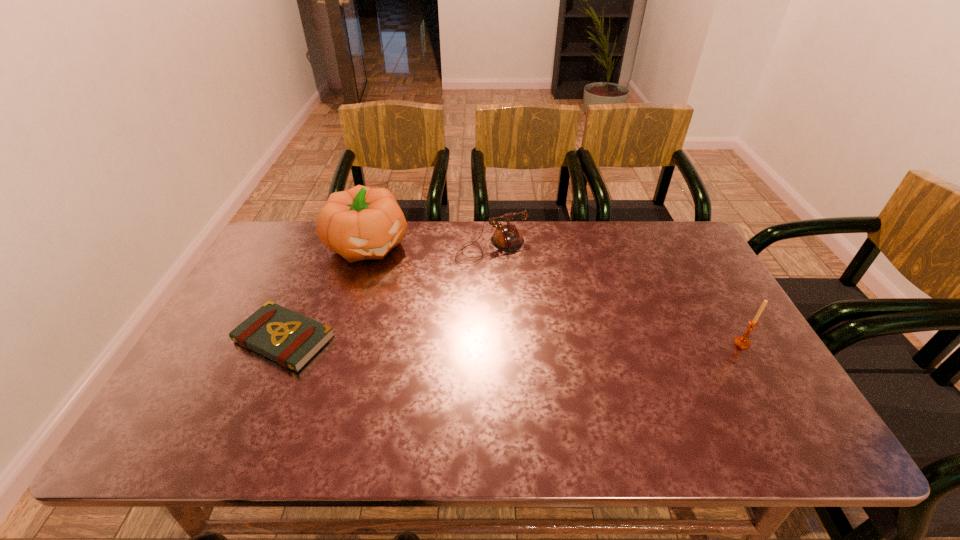
I want to click on free location located 0.320m on the rotary dial of the third tallest object, so click(x=555, y=336).

Locate an element on the screen. free region located on the carved face of the pumpkin is located at coordinates (402, 281).

Find the location of a particular element. This screenshot has height=540, width=960. free region located 0.380m on the carved face of the pumpkin is located at coordinates (456, 341).

Where is `vacant space located 0.070m on the carved face of the pumpkin`? This screenshot has height=540, width=960. vacant space located 0.070m on the carved face of the pumpkin is located at coordinates (398, 278).

Locate an element on the screen. The height and width of the screenshot is (540, 960). telephone at the far edge is located at coordinates [x=507, y=237].

Locate an element on the screen. Image resolution: width=960 pixels, height=540 pixels. pumpkin that is positioned at the far edge is located at coordinates (361, 223).

You are a GUI agent. You are given a task and a screenshot of the screen. Output one action in this format:
    pyautogui.click(x=<x>, y=<y>)
    Task: Click on the object present at the left edge
    This screenshot has width=960, height=540.
    Given the screenshot: What is the action you would take?
    pyautogui.click(x=291, y=339)

The height and width of the screenshot is (540, 960). I want to click on object situated at the right edge, so click(x=742, y=341).

You are a GUI agent. You are given a task and a screenshot of the screen. Output one action in this format:
    pyautogui.click(x=<x>, y=<y>)
    Task: Click on the vacant space at the far edge of the desktop
    The image size is (960, 540).
    Given the screenshot: What is the action you would take?
    pyautogui.click(x=434, y=256)

What are the coordinates of `blank space at the near edge of the desktop` in the screenshot? It's located at (634, 391).